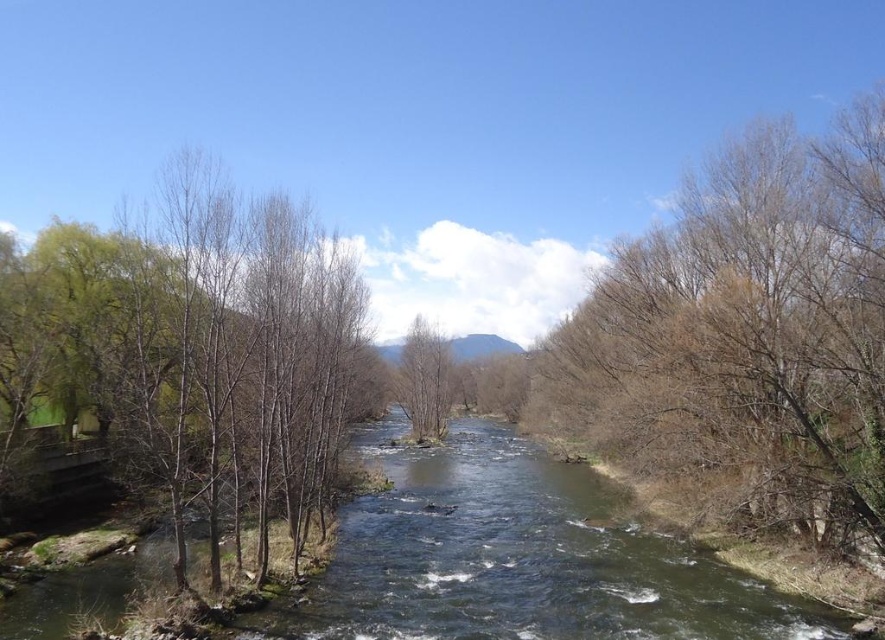
You are planning to plant a new tree in the riverbank. You want to ensure it is equidistant from both the bare branches at right and the bare wood tree at center. What is the minimum distance you should maintain from each to achieve this?

The minimum distance to maintain from each is half of 36.29 meters, so 18.145 meters.

You are an environmental scientist observing the river scene. You need to determine which of the two trees, the bare branches at right or the bare wood tree at center, has a smaller diameter. Which one should you report?

The bare branches at right is thinner than the bare wood tree at center, so you should report that the bare branches at right has a smaller diameter.

You are standing at the riverside and want to take a photo of the green leafy tree at left. If your camera has a maximum focus range of 15 meters, will you be able to capture the tree clearly?

The green leafy tree at left is 13.76 meters away from the viewer, which is within the camera maximum focus range of 15 meters. Therefore, you can capture the tree clearly.